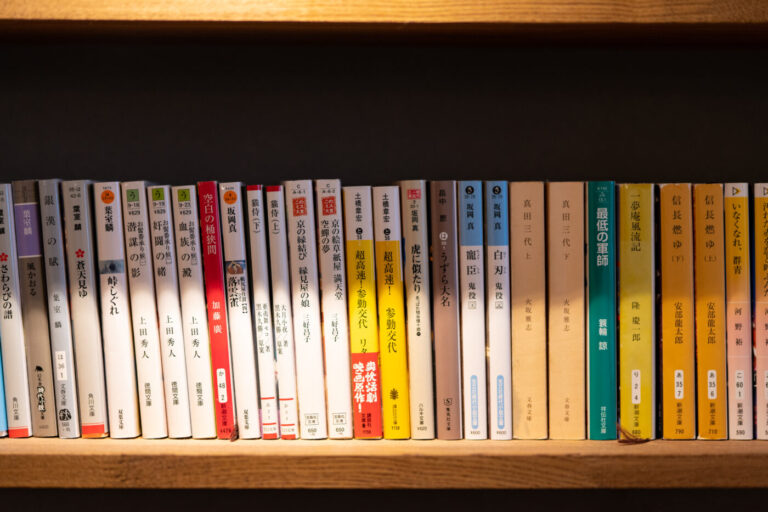
In order to click on yellow books in this screenshot , I will do coord(644,340), coord(664,342), coord(713,345), coord(730,277), coord(756,272), coord(353,303), coord(386,310).